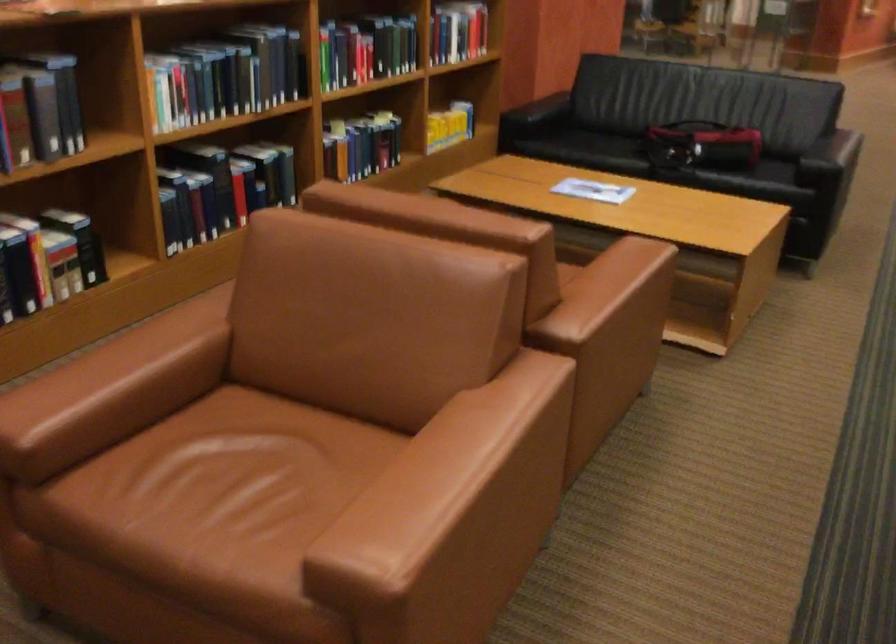
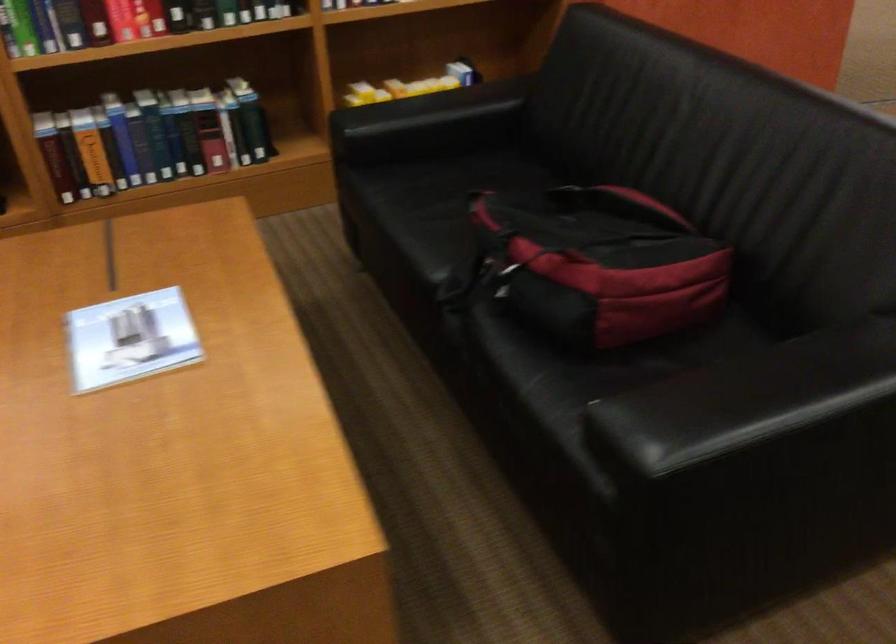
The point at [372,147] is marked in the first image. Where is the corresponding point in the second image?

(151, 138)